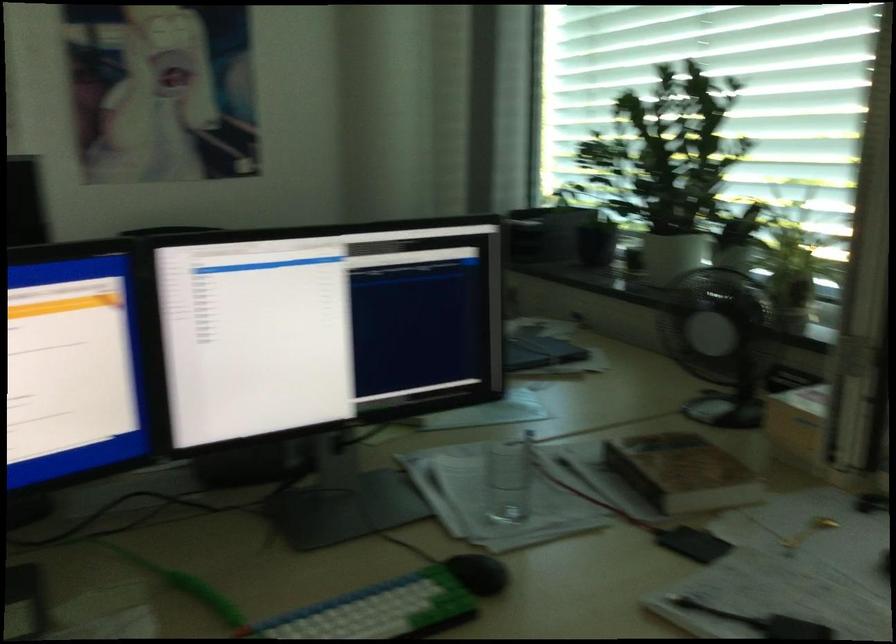
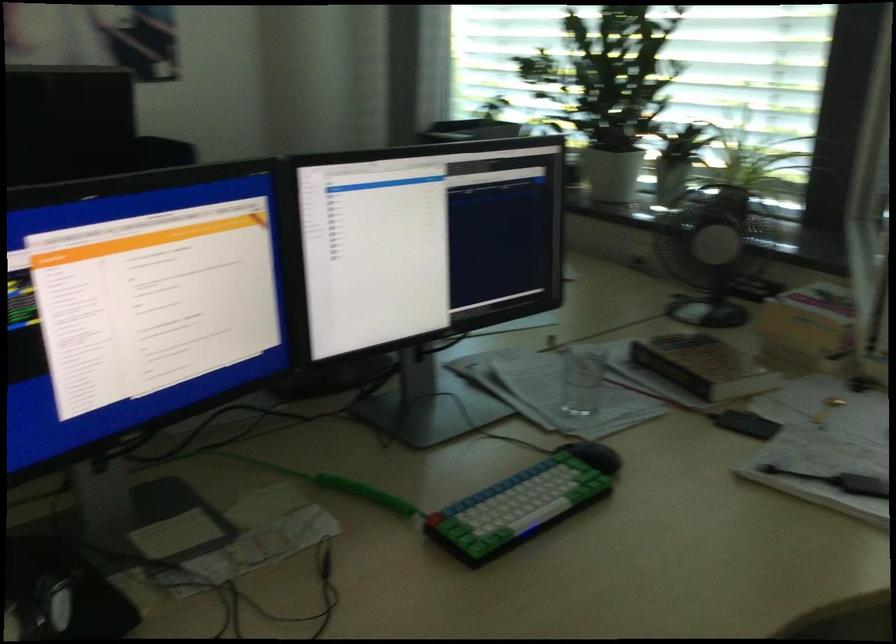
The point at (711,343) is marked in the first image. Where is the corresponding point in the second image?

(711, 252)